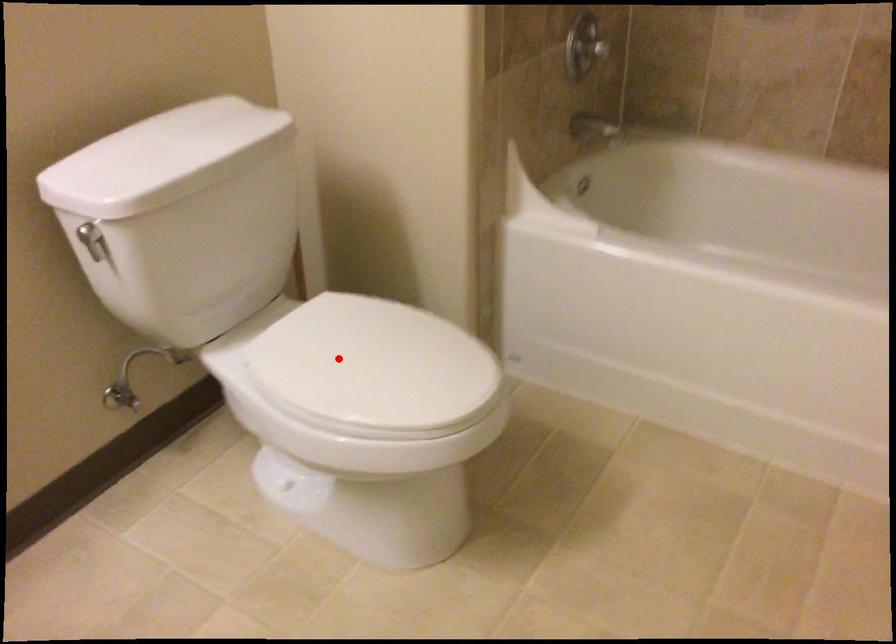
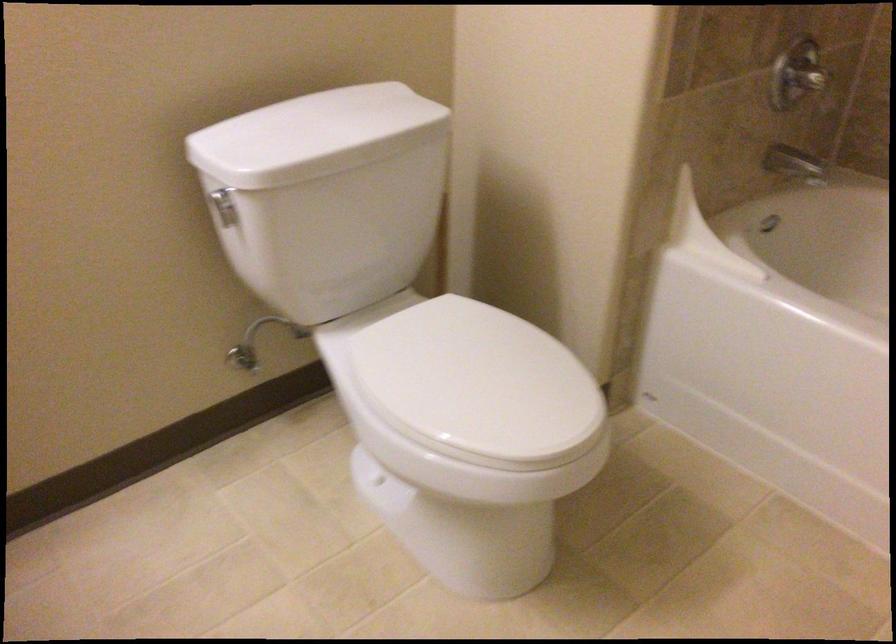
In the second image, find the point that corresponds to the highlighted location in the first image.

(442, 363)